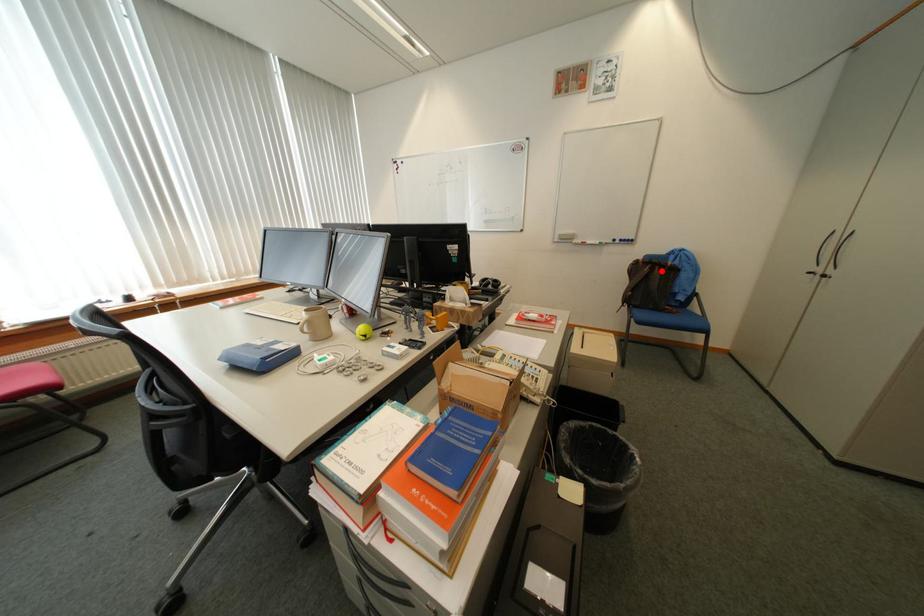
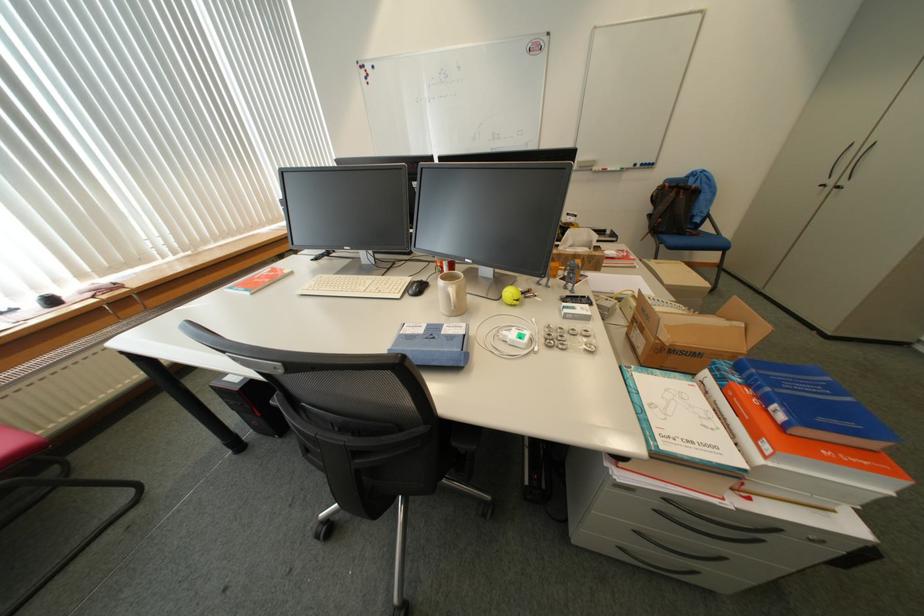
Question: I am providing you with two images of the same scene from different viewpoints. In image1, a red point is highlighted. Considering the same 3D point in image2, which of the following is correct?

Choices:
 (A) It is closer
 (B) It is farther

Answer: (A)